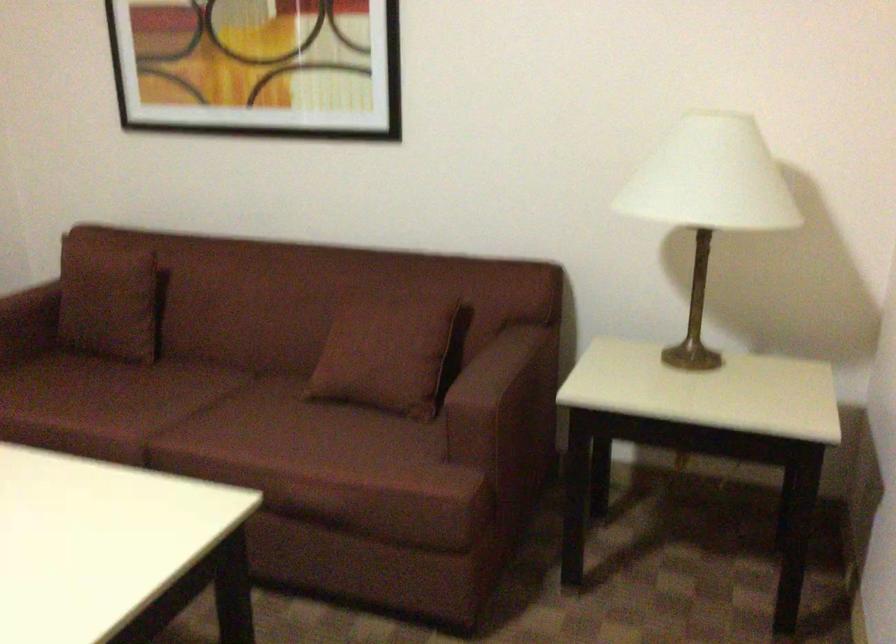
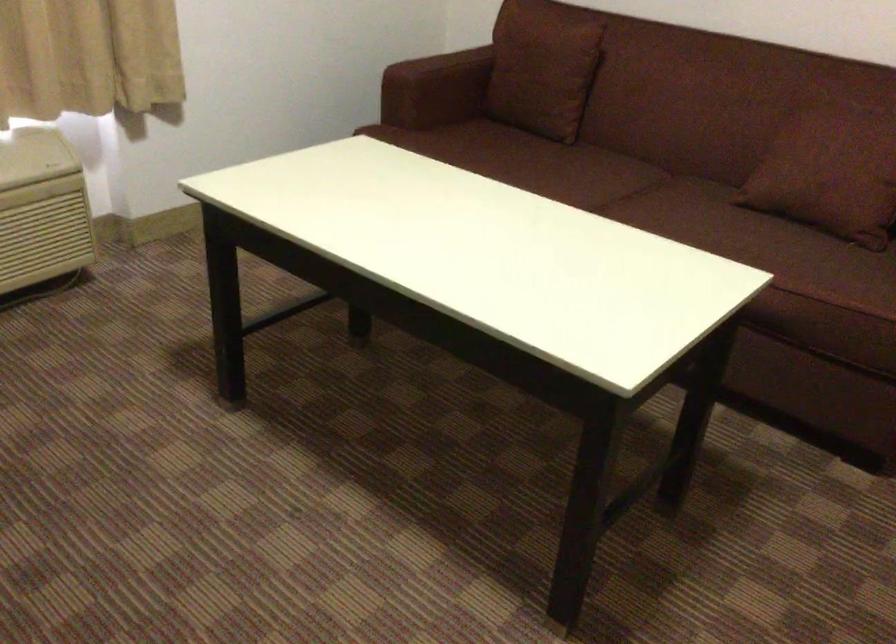
In the second image, find the point that corresponds to pixel 106 297 in the first image.

(543, 69)